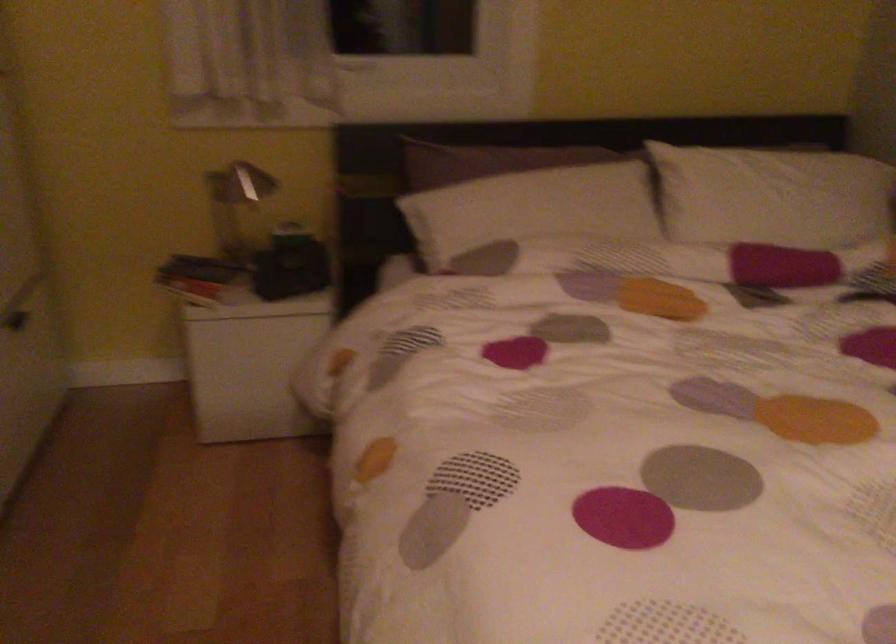
In order to click on drawer handle in this screenshot , I will do `click(21, 323)`.